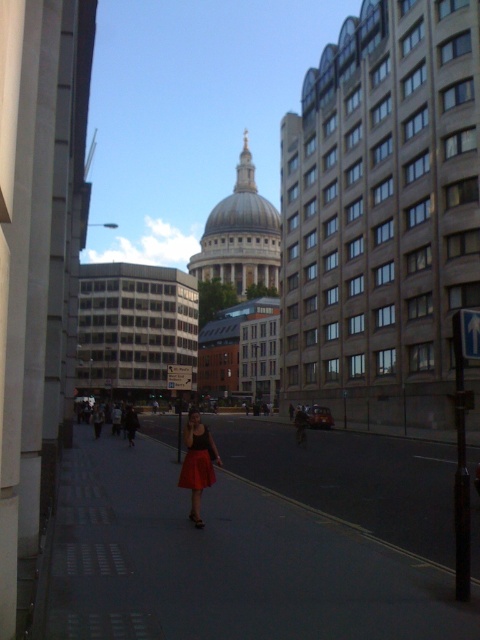
Question: Is smooth concrete sidewalk at center thinner than matte red skirt at center?

Choices:
 (A) yes
 (B) no

Answer: (B)

Question: Is smooth concrete sidewalk at center closer to camera compared to matte red skirt at center?

Choices:
 (A) no
 (B) yes

Answer: (B)

Question: Which of the following is the closest to the observer?

Choices:
 (A) (164, 630)
 (B) (203, 426)
 (C) (201, 490)

Answer: (A)

Question: Based on their relative distances, which object is farther from the smooth concrete sidewalk at center?

Choices:
 (A) matte red dress at center
 (B) matte red skirt at center

Answer: (A)

Question: Can you confirm if smooth concrete sidewalk at center is positioned to the right of matte red skirt at center?

Choices:
 (A) no
 (B) yes

Answer: (A)

Question: Among these objects, which one is nearest to the camera?

Choices:
 (A) smooth concrete sidewalk at center
 (B) matte red skirt at center

Answer: (A)